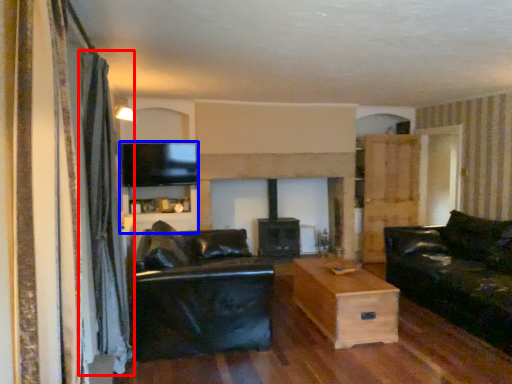
Question: Which object is further to the camera taking this photo, curtain (highlighted by a red box) or entertainment center (highlighted by a blue box)?

Choices:
 (A) curtain
 (B) entertainment center

Answer: (B)